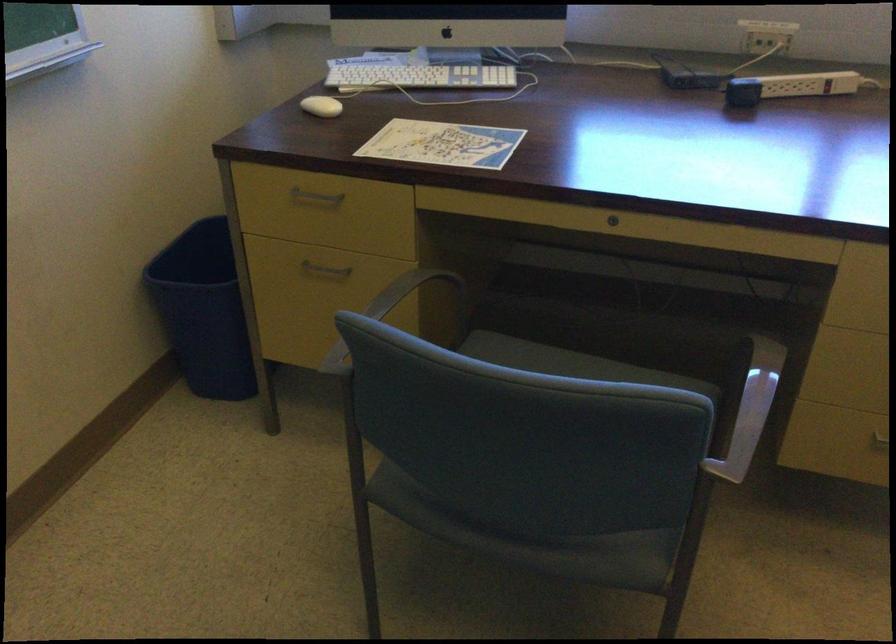
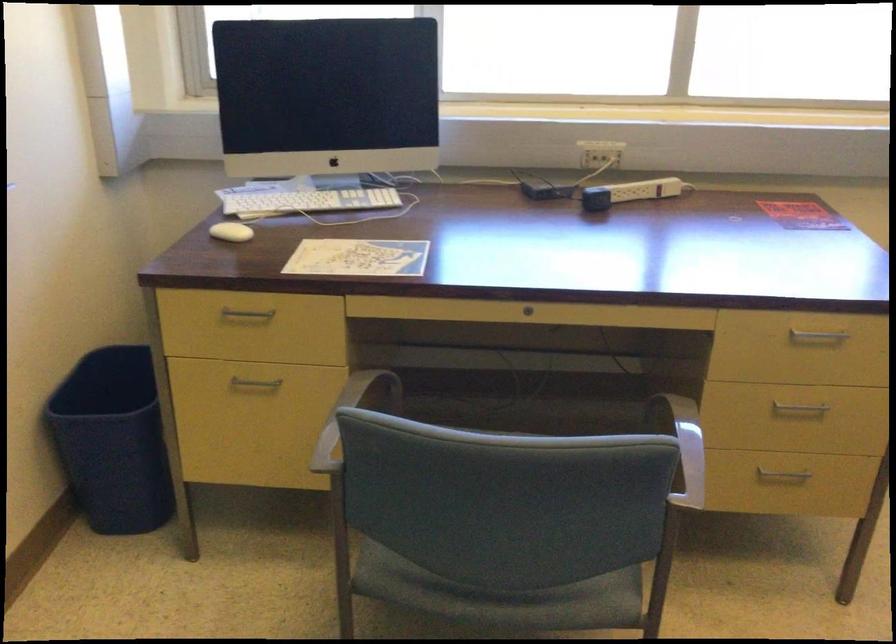
Locate, in the second image, the point that corresponds to point 314,196 in the first image.

(247, 313)